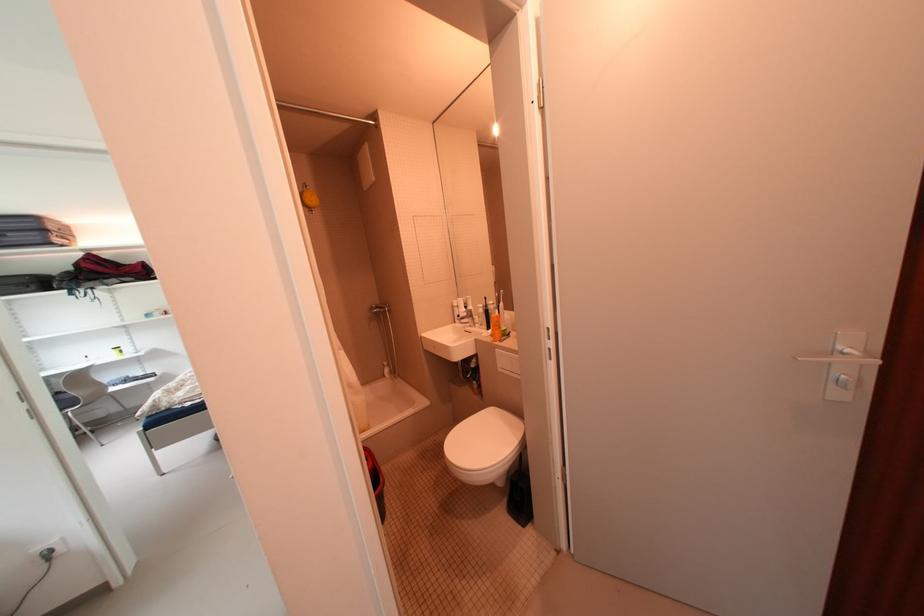
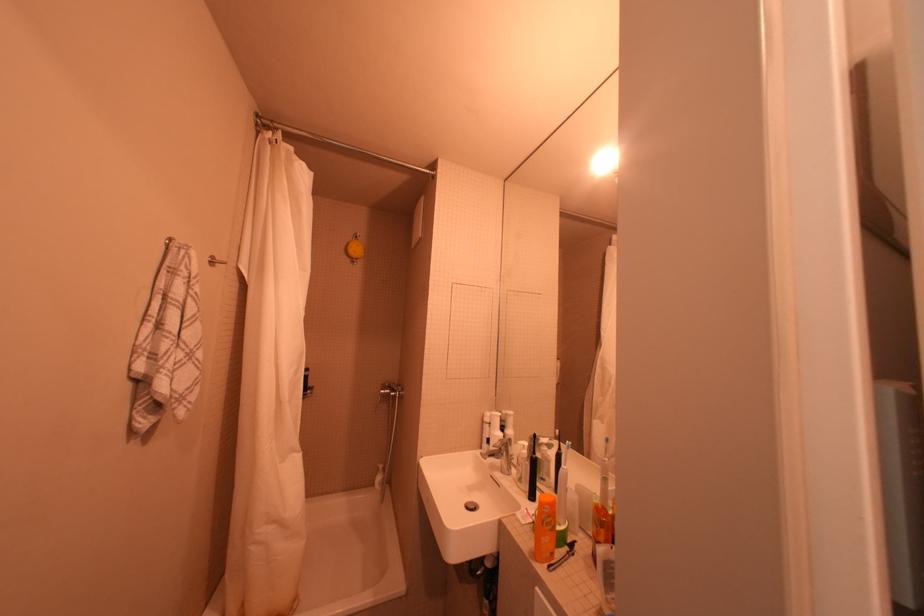
Find the pixel in the second image that matches point 476,315 in the first image.

(508, 450)